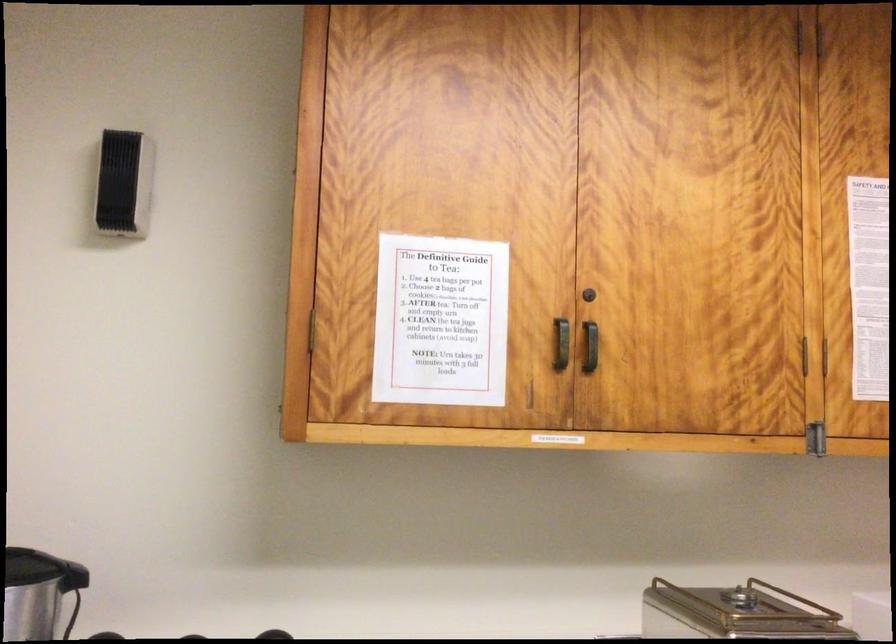
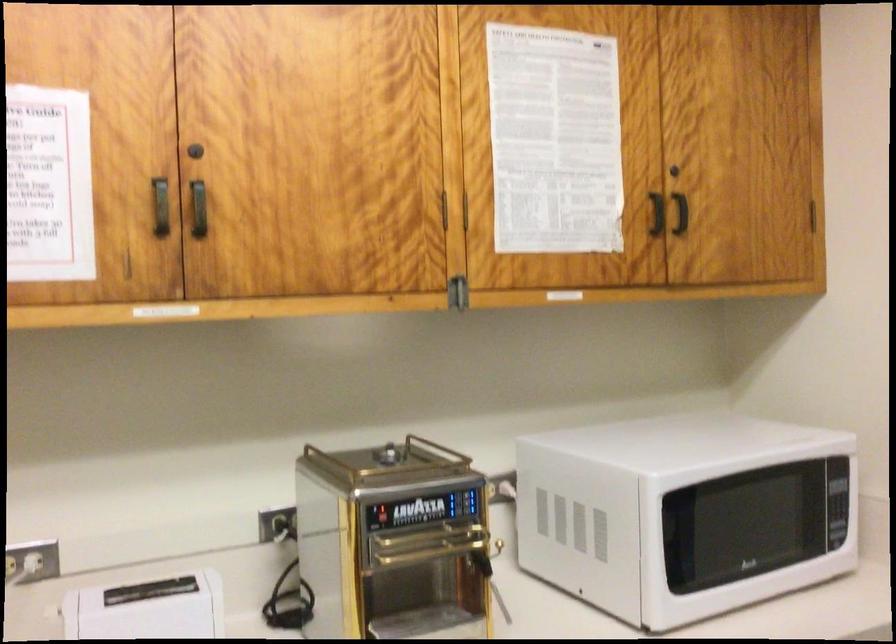
In the second image, find the point that corresponds to [817,437] in the first image.

(458, 292)